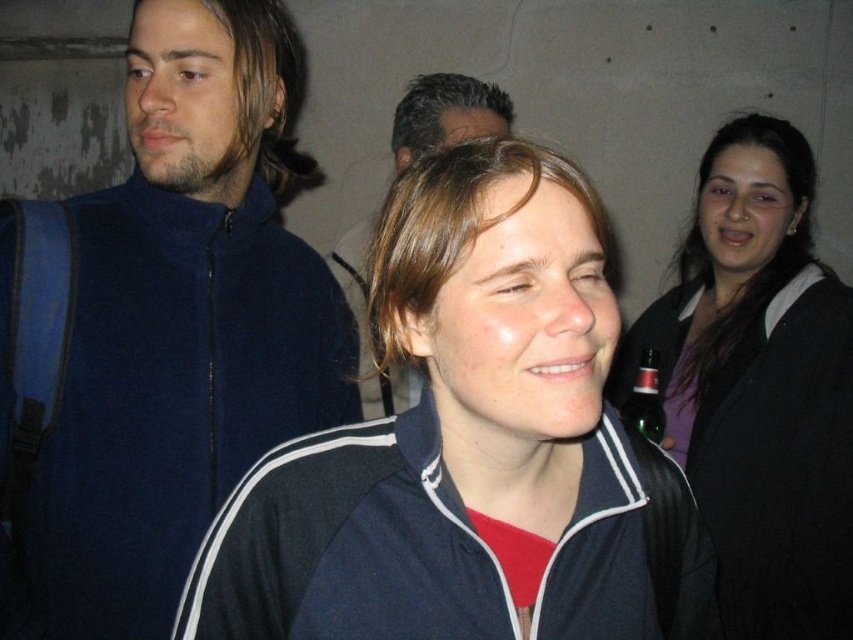
Question: Can you confirm if dark blue track jacket at center is positioned to the right of matte black jacket at right?

Choices:
 (A) yes
 (B) no

Answer: (B)

Question: Can you confirm if blue fleece jacket at left is smaller than dark blue fleece at center?

Choices:
 (A) no
 (B) yes

Answer: (B)

Question: Which point appears farthest from the camera in this image?

Choices:
 (A) (643, 355)
 (B) (448, 80)
 (C) (450, 627)
 (D) (57, 412)

Answer: (B)

Question: Based on their relative distances, which object is nearer to the green glass bottle at right?

Choices:
 (A) blue fleece jacket at left
 (B) dark blue fleece at center

Answer: (B)

Question: Does dark blue track jacket at center lie behind matte black jacket at right?

Choices:
 (A) yes
 (B) no

Answer: (B)

Question: Among these points, which one is farthest from the camera?

Choices:
 (A) (527, 444)
 (B) (242, 360)

Answer: (B)